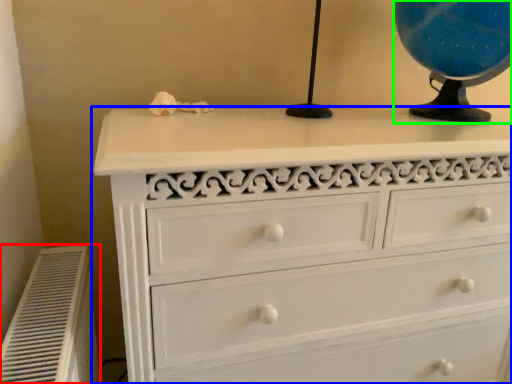
Question: Which object is positioned closest to air conditioner (highlighted by a red box)? Select from chest of drawers (highlighted by a blue box) and table lamp (highlighted by a green box).

Choices:
 (A) chest of drawers
 (B) table lamp

Answer: (A)